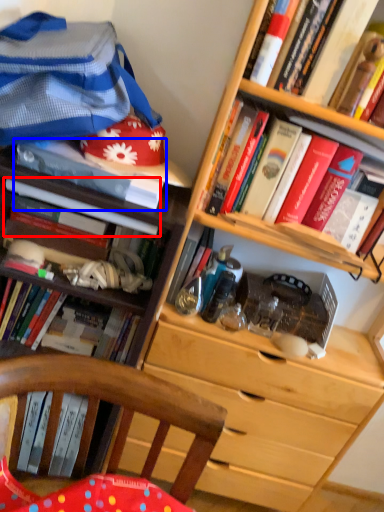
Question: Which object is further to the camera taking this photo, book (highlighted by a red box) or book (highlighted by a blue box)?

Choices:
 (A) book
 (B) book

Answer: (A)